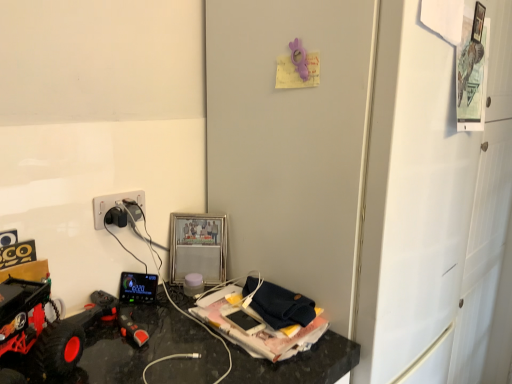
In order to click on black plastic power plugs and sockets at left in this screenshot , I will do `click(113, 204)`.

The width and height of the screenshot is (512, 384). What do you see at coordinates (37, 328) in the screenshot?
I see `rubberized black toy car at lower left` at bounding box center [37, 328].

This screenshot has width=512, height=384. What do you see at coordinates (193, 284) in the screenshot?
I see `matte white cup at center, placed as the second toy when sorted from bottom to top` at bounding box center [193, 284].

This screenshot has width=512, height=384. What do you see at coordinates (110, 316) in the screenshot? I see `rubberized black remote control at lower left, which appears as the 1th toy when viewed from the left` at bounding box center [110, 316].

In order to click on rubberized black remote control at lower left, the first toy positioned from the front in this screenshot , I will do `click(110, 316)`.

Find the location of a particular element. This screenshot has height=384, width=512. black plastic power plugs and sockets at left is located at coordinates (113, 204).

Are rubberized black toy car at lower left and black plastic power plugs and sockets at left beside each other?

No, rubberized black toy car at lower left is not making contact with black plastic power plugs and sockets at left.

Based on the photo, how distant is rubberized black toy car at lower left from black plastic power plugs and sockets at left?

rubberized black toy car at lower left and black plastic power plugs and sockets at left are 29.56 centimeters apart.

Locate an element on the screen. The width and height of the screenshot is (512, 384). toy car on the left of the black plastic power plugs and sockets at left is located at coordinates (37, 328).

Is rubberized black toy car at lower left facing towards black plastic power plugs and sockets at left?

No.

Considering the sizes of objects white matte door at center-right and rubberized black toy car at lower left in the image provided, who is bigger, white matte door at center-right or rubberized black toy car at lower left?

Bigger between the two is white matte door at center-right.

Between white matte door at center-right and rubberized black toy car at lower left, which one has smaller width?

Thinner between the two is rubberized black toy car at lower left.

Is rubberized black toy car at lower left a part of white matte door at center-right?

No, rubberized black toy car at lower left is located outside of white matte door at center-right.

From the image's perspective, starting from the purple rubber duck at upper center, acting as the first toy starting from the top, which toy is the 1st one below? Please provide its 2D coordinates.

[(193, 284)]

Looking at this image, is matte white cup at center, positioned as the 1th toy in back-to-front order, facing away from purple rubber duck at upper center, placed as the second toy when sorted from front to back?

No, matte white cup at center, positioned as the 1th toy in back-to-front order, is not facing the opposite direction of purple rubber duck at upper center, placed as the second toy when sorted from front to back.

Is matte white cup at center, placed as the second toy when sorted from bottom to top, far from purple rubber duck at upper center, acting as the first toy starting from the top?

matte white cup at center, placed as the second toy when sorted from bottom to top, is near purple rubber duck at upper center, acting as the first toy starting from the top, not far away.

Considering the positions of points (298, 42) and (99, 205), is point (298, 42) farther from camera compared to point (99, 205)?

No.

This screenshot has height=384, width=512. What are the coordinates of `the 1st toy in front of the black plastic power plugs and sockets at left, counting from the anchor's position` in the screenshot? It's located at (298, 58).

Could black plastic power plugs and sockets at left be considered to be inside purple rubber duck at upper center, acting as the first toy starting from the top?

No, black plastic power plugs and sockets at left is not surrounded by purple rubber duck at upper center, acting as the first toy starting from the top.

Is black plastic power plugs and sockets at left to the left of rubberized black toy car at lower left from the viewer's perspective?

No.

Would you say black plastic power plugs and sockets at left is inside or outside rubberized black toy car at lower left?

black plastic power plugs and sockets at left is spatially situated outside rubberized black toy car at lower left.

Which object is thinner, black plastic power plugs and sockets at left or rubberized black toy car at lower left?

black plastic power plugs and sockets at left.

Is black plastic power plugs and sockets at left positioned with its back to rubberized black toy car at lower left?

That's not correct — black plastic power plugs and sockets at left is not looking away from rubberized black toy car at lower left.

Looking at this image, how distant is black plastic power plugs and sockets at left from rubberized black remote control at lower left, which ranks as the 1th toy in bottom-to-top order?

black plastic power plugs and sockets at left and rubberized black remote control at lower left, which ranks as the 1th toy in bottom-to-top order, are 9.52 inches apart.

Is black plastic power plugs and sockets at left behind rubberized black remote control at lower left, which appears as the 1th toy when viewed from the left?

Yes, the depth of black plastic power plugs and sockets at left is greater than that of rubberized black remote control at lower left, which appears as the 1th toy when viewed from the left.

Can rubberized black remote control at lower left, which appears as the 1th toy when viewed from the left, be found inside black plastic power plugs and sockets at left?

No, rubberized black remote control at lower left, which appears as the 1th toy when viewed from the left, is located outside of black plastic power plugs and sockets at left.

Who is taller, rubberized black remote control at lower left, which appears as the 1th toy when viewed from the left, or rubberized black toy car at lower left?

With more height is rubberized black toy car at lower left.

Identify the location of toy car above the rubberized black remote control at lower left, arranged as the third toy when viewed from the top (from the image's perspective). (37, 328).

Can you tell me how much rubberized black remote control at lower left, which ranks as the 1th toy in bottom-to-top order, and rubberized black toy car at lower left differ in facing direction?

The angle between the facing direction of rubberized black remote control at lower left, which ranks as the 1th toy in bottom-to-top order, and the facing direction of rubberized black toy car at lower left is 39.7 degrees.

Does rubberized black remote control at lower left, the first toy positioned from the front, have a larger size compared to rubberized black toy car at lower left?

Incorrect, rubberized black remote control at lower left, the first toy positioned from the front, is not larger than rubberized black toy car at lower left.

Find the location of a particular element. The width and height of the screenshot is (512, 384). toy car located below the black plastic power plugs and sockets at left (from the image's perspective) is located at coordinates (37, 328).

Image resolution: width=512 pixels, height=384 pixels. Identify the location of door behind the rubberized black toy car at lower left. (291, 143).

Looking at the image, which one is located further to purple rubber duck at upper center, the 1th toy from the right, rubberized black remote control at lower left, the 3th toy viewed from the right, or black plastic power plugs and sockets at left?

rubberized black remote control at lower left, the 3th toy viewed from the right, lies further to purple rubber duck at upper center, the 1th toy from the right, than the other object.

Looking at the image, which one is located closer to black plastic power plugs and sockets at left, matte white cup at center, which is the third toy from front to back, or white matte door at center-right?

matte white cup at center, which is the third toy from front to back, is positioned closer to the anchor black plastic power plugs and sockets at left.

Based on their spatial positions, is black plastic power plugs and sockets at left or rubberized black toy car at lower left further from white matte door at center-right?

Among the two, rubberized black toy car at lower left is located further to white matte door at center-right.

Which object lies further to the anchor point rubberized black toy car at lower left, white matte door at center-right or purple rubber duck at upper center, which appears as the 3th toy when ordered from the bottom?

purple rubber duck at upper center, which appears as the 3th toy when ordered from the bottom.

Considering their positions, is purple rubber duck at upper center, acting as the first toy starting from the top, positioned closer to black plastic power plugs and sockets at left than rubberized black remote control at lower left, which appears as the 3th toy when viewed from the back?

The object closer to black plastic power plugs and sockets at left is rubberized black remote control at lower left, which appears as the 3th toy when viewed from the back.

In the scene shown: From the image, which object appears to be nearer to white matte door at center-right, purple rubber duck at upper center, the 1th toy from the right, or black plastic power plugs and sockets at left?

purple rubber duck at upper center, the 1th toy from the right.

Looking at the image, which one is located closer to black plastic power plugs and sockets at left, rubberized black remote control at lower left, the 3th toy viewed from the right, or purple rubber duck at upper center, placed as the second toy when sorted from back to front?

Based on the image, rubberized black remote control at lower left, the 3th toy viewed from the right, appears to be nearer to black plastic power plugs and sockets at left.

Which object lies further to the anchor point rubberized black remote control at lower left, the first toy positioned from the front, rubberized black toy car at lower left or purple rubber duck at upper center, placed as the second toy when sorted from back to front?

purple rubber duck at upper center, placed as the second toy when sorted from back to front, is further to rubberized black remote control at lower left, the first toy positioned from the front.

Where is `door between purple rubber duck at upper center, placed as the second toy when sorted from front to back, and matte white cup at center, which is the third toy from front to back, from top to bottom`? The height and width of the screenshot is (384, 512). door between purple rubber duck at upper center, placed as the second toy when sorted from front to back, and matte white cup at center, which is the third toy from front to back, from top to bottom is located at coordinates (291, 143).

What are the coordinates of `toy between purple rubber duck at upper center, placed as the second toy when sorted from back to front, and rubberized black toy car at lower left from top to bottom` in the screenshot? It's located at pos(193,284).

Where is `door that lies between purple rubber duck at upper center, placed as the second toy when sorted from front to back, and rubberized black remote control at lower left, which ranks as the 1th toy in bottom-to-top order, from top to bottom`? The height and width of the screenshot is (384, 512). door that lies between purple rubber duck at upper center, placed as the second toy when sorted from front to back, and rubberized black remote control at lower left, which ranks as the 1th toy in bottom-to-top order, from top to bottom is located at coordinates (291, 143).

The image size is (512, 384). I want to click on power plugs and sockets between rubberized black toy car at lower left and matte white cup at center, the second toy viewed from the left, from front to back, so click(113, 204).